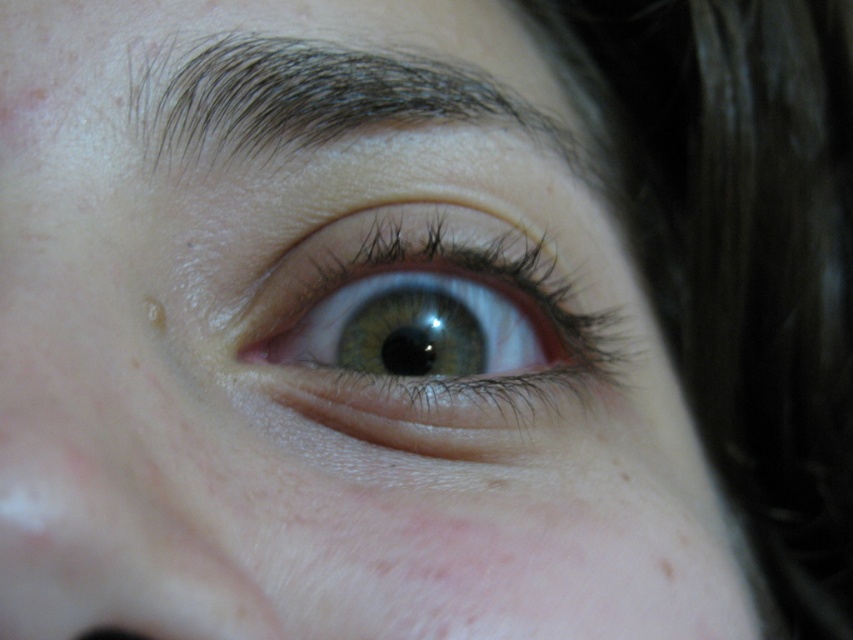
Question: Does green glossy eye at center have a greater width compared to dark brown hair at upper center?

Choices:
 (A) yes
 (B) no

Answer: (B)

Question: Is green glossy eye at center to the left of dark brown hair at upper center from the viewer's perspective?

Choices:
 (A) yes
 (B) no

Answer: (A)

Question: Does green glossy eye at center have a smaller size compared to dark brown hair at upper center?

Choices:
 (A) yes
 (B) no

Answer: (A)

Question: Among these points, which one is farthest from the camera?

Choices:
 (A) (206, 68)
 (B) (445, 225)

Answer: (B)